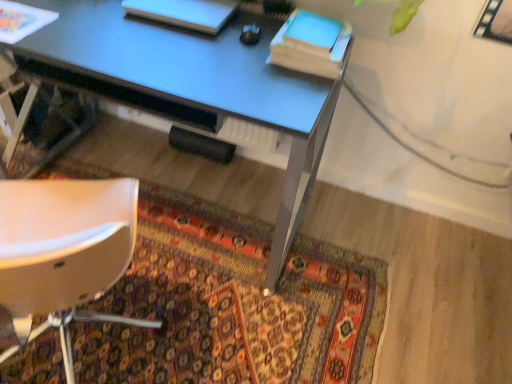
Identify the location of vacant space in front of matte blue book at upper right, positioned as the second book in left-to-right order. (275, 89).